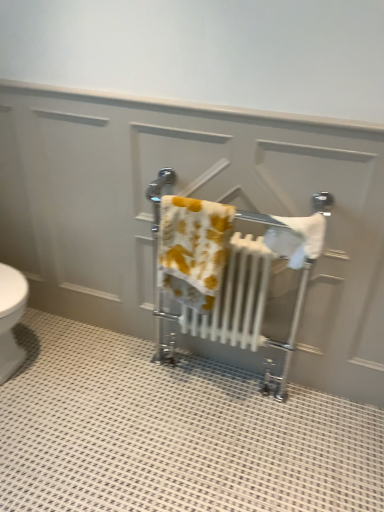
This screenshot has width=384, height=512. In order to click on vacant space to the left of white metallic towel rack at center in this screenshot , I will do `click(121, 394)`.